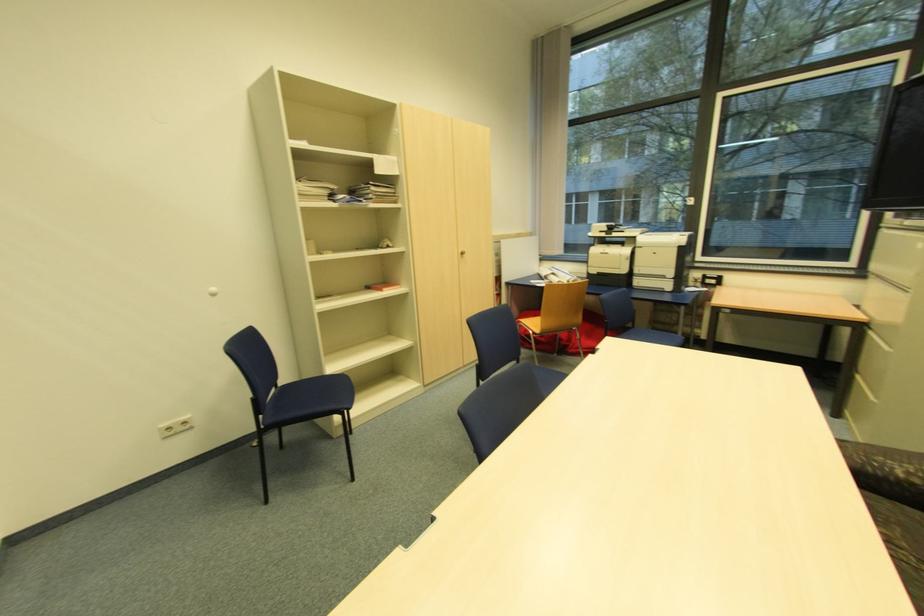
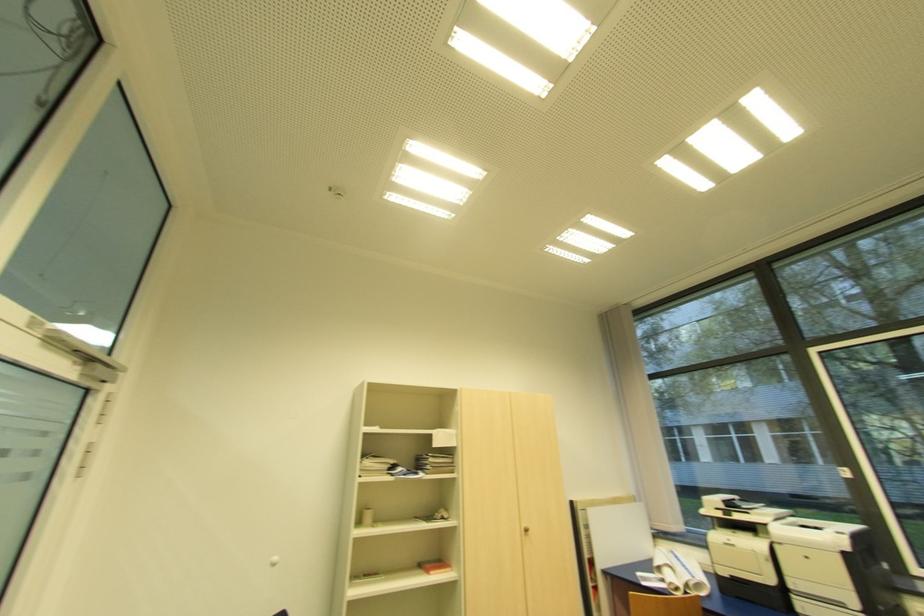
First-person continuous shooting, in which direction is the camera rotating?

The camera rotated toward left-up.